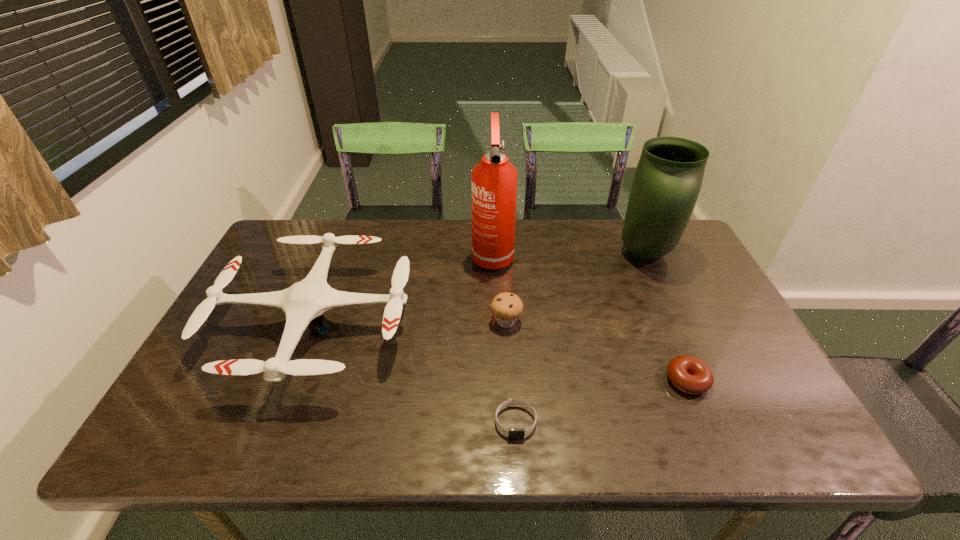
Image resolution: width=960 pixels, height=540 pixels. What are the coordinates of `free area in between the fourth shortest object and the doughnut` in the screenshot? It's located at (502, 353).

I want to click on vacant point located between the tallest object and the doughnut, so click(x=589, y=318).

The image size is (960, 540). In order to click on free space between the vase and the leftmost object in this screenshot , I will do `click(481, 289)`.

Point out which object is positioned as the fourth nearest to the fourth tallest object. Please provide its 2D coordinates. Your answer should be formatted as a tuple, i.e. [(x, y)], where the tuple contains the x and y coordinates of a point satisfying the conditions above.

[(689, 374)]

Find the location of a particular element. object that stands as the second closest to the vase is located at coordinates (494, 180).

Locate an element on the screen. blank area in the image that satisfies the following two spatial constraints: 1. with the camera attached at the bottom of the fifth tallest object; 2. on the right side of the third tallest object is located at coordinates (296, 380).

Where is `free space in the image that satisfies the following two spatial constraints: 1. on the front side of the muffin; 2. with the camera attached at the bottom of the drone`? The image size is (960, 540). free space in the image that satisfies the following two spatial constraints: 1. on the front side of the muffin; 2. with the camera attached at the bottom of the drone is located at coordinates (506, 325).

Identify the location of vacant region that satisfies the following two spatial constraints: 1. at the nozzle of the tallest object; 2. on the left side of the fourth tallest object. (494, 321).